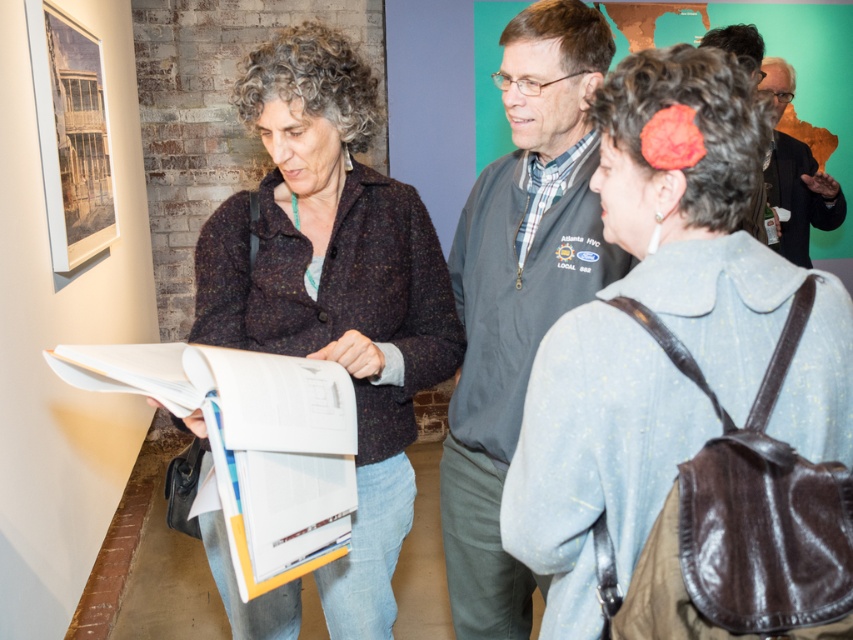
This screenshot has height=640, width=853. Describe the element at coordinates (334, 288) in the screenshot. I see `speckled wool sweater at center` at that location.

Between speckled wool sweater at center and gray fleece vest at center, which one appears on the right side from the viewer's perspective?

gray fleece vest at center

Locate an element on the screen. This screenshot has height=640, width=853. speckled wool sweater at center is located at coordinates (334, 288).

Is denim jacket at center shorter than matte gray jacket at upper right?

Indeed, denim jacket at center has a lesser height compared to matte gray jacket at upper right.

Is denim jacket at center to the left of matte gray jacket at upper right from the viewer's perspective?

Yes, denim jacket at center is to the left of matte gray jacket at upper right.

Image resolution: width=853 pixels, height=640 pixels. Describe the element at coordinates (643, 330) in the screenshot. I see `denim jacket at center` at that location.

Where is `denim jacket at center`? This screenshot has height=640, width=853. denim jacket at center is located at coordinates (643, 330).

Between point (738, 92) and point (422, 244), which one is positioned in front?

Point (738, 92) is more forward.

Does point (738, 230) come closer to viewer compared to point (302, 300)?

Yes.

Locate an element on the screen. denim jacket at center is located at coordinates (643, 330).